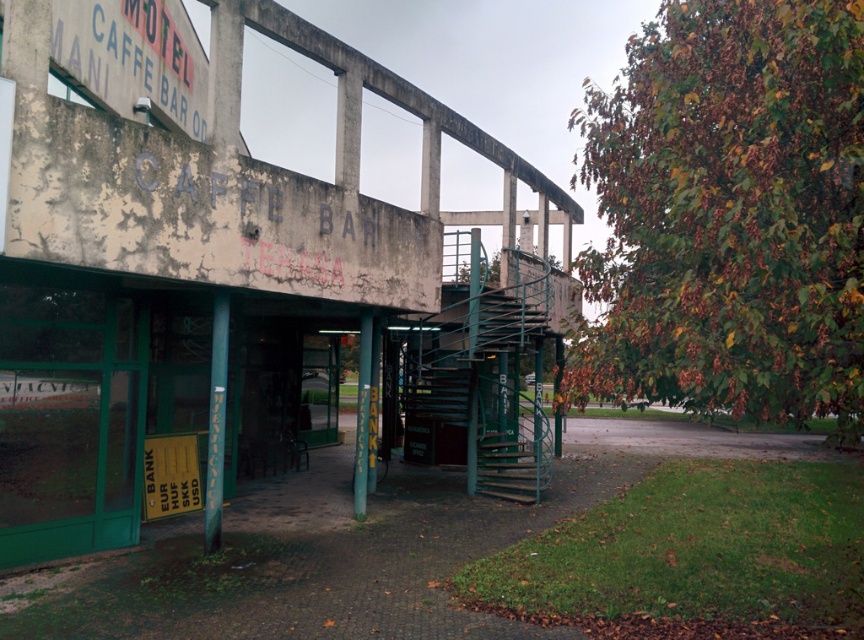
You are standing in front of the building and want to read both the weathered concrete sign at upper left and the yellow plastic sign at lower left. Which sign should you look at first to read them in the correct left to right order?

You should look at the weathered concrete sign at upper left first because it is positioned to the left of the yellow plastic sign at lower left, following the left to right order.

You are standing at the bottom of the green metal staircase at lower center and want to look at the weathered concrete sign at upper left. In which direction should you turn your head?

The weathered concrete sign at upper left is positioned on the left side of green metal staircase at lower center, so you should turn your head to the left to look at it.